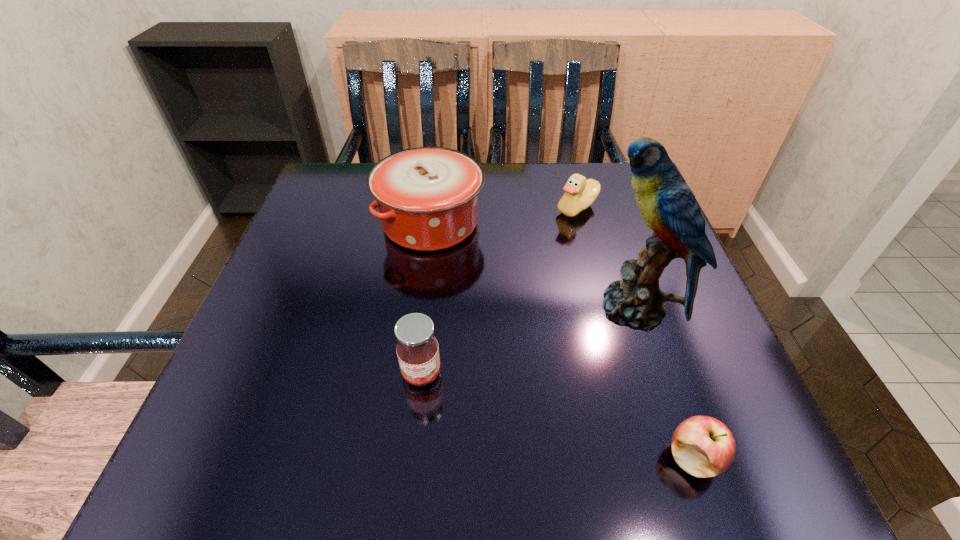
I want to click on free space located 0.110m on the face of the third farthest object, so click(x=531, y=309).

I want to click on vacant space located on the right of the second tallest object, so click(556, 223).

Where is `free spot located on the label side of the second nearest object`? free spot located on the label side of the second nearest object is located at coordinates (415, 440).

This screenshot has height=540, width=960. What are the coordinates of `vacant space situated 0.090m at the beak of the fourth tallest object` in the screenshot? It's located at (516, 208).

The image size is (960, 540). I want to click on vacant space located at the beak of the fourth tallest object, so click(x=469, y=208).

Where is `vacant space situated 0.280m at the beak of the fourth tallest object`? This screenshot has width=960, height=540. vacant space situated 0.280m at the beak of the fourth tallest object is located at coordinates (436, 208).

The image size is (960, 540). Find the location of `vacant space located on the left of the shortest object`. vacant space located on the left of the shortest object is located at coordinates (x=616, y=458).

Identify the location of casserole present at the far edge. (427, 197).

I want to click on duck situated at the far edge, so click(580, 193).

Image resolution: width=960 pixels, height=540 pixels. In order to click on object that is at the near edge in this screenshot , I will do `click(704, 447)`.